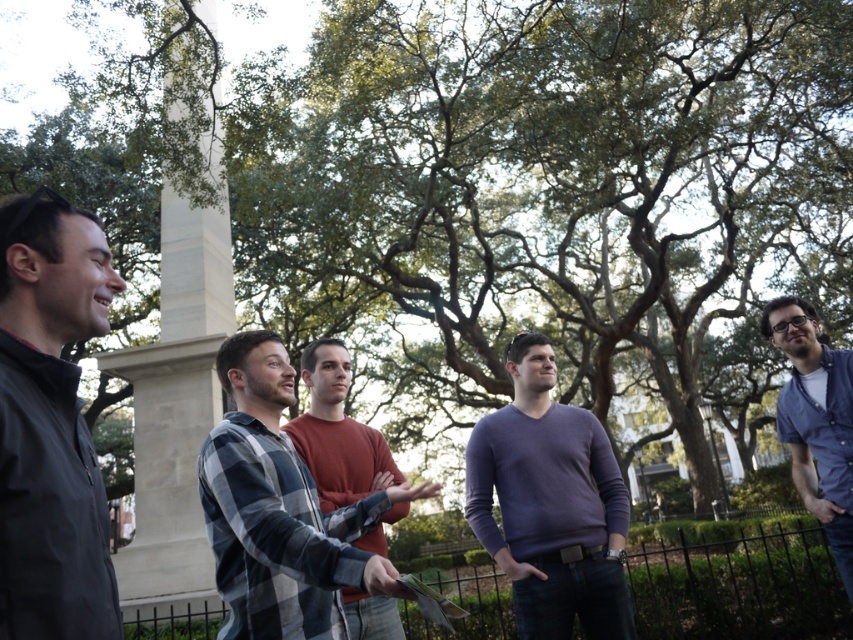
Which is more to the left, light gray stone pillar at left or blue button-up shirt at right?

From the viewer's perspective, light gray stone pillar at left appears more on the left side.

Is point (177, 602) positioned after point (810, 349)?

Yes, point (177, 602) is farther from viewer.

Where is `light gray stone pillar at left`? The image size is (853, 640). light gray stone pillar at left is located at coordinates (177, 404).

Is checkered fabric shirt at center positioned behind blue button-up shirt at right?

No.

Is checkered fabric shirt at center taller than blue button-up shirt at right?

Incorrect, checkered fabric shirt at center's height is not larger of blue button-up shirt at right's.

Between point (239, 456) and point (769, 307), which one is positioned behind?

The point (769, 307) is behind.

You are a GUI agent. You are given a task and a screenshot of the screen. Output one action in this format:
    pyautogui.click(x=<x>, y=<y>)
    Task: Click on the checkered fabric shirt at center
    
    Given the screenshot: What is the action you would take?
    pyautogui.click(x=280, y=509)

Can you confirm if dark gray jacket at left is taller than blue button-up shirt at right?

Answer: No, dark gray jacket at left is not taller than blue button-up shirt at right.

Is dark gray jacket at left bigger than blue button-up shirt at right?

Actually, dark gray jacket at left might be smaller than blue button-up shirt at right.

Does point (45, 520) come farther from viewer compared to point (814, 369)?

No, (45, 520) is in front of (814, 369).

Image resolution: width=853 pixels, height=640 pixels. I want to click on dark gray jacket at left, so click(x=50, y=426).